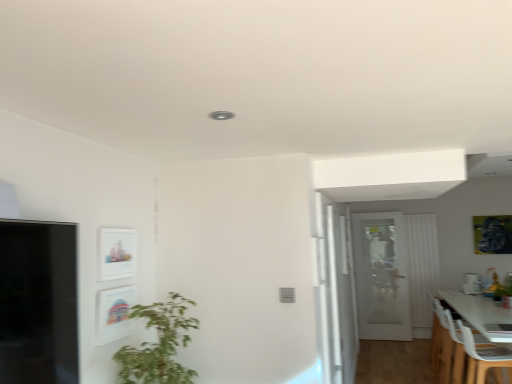
The image size is (512, 384). Identify the location of transparent glass door at center. pyautogui.click(x=339, y=292).

The width and height of the screenshot is (512, 384). Find the location of `green leafy plant at lower left`. green leafy plant at lower left is located at coordinates (159, 344).

Locate an element on the screen. This screenshot has width=512, height=384. white plastic chair at lower right, the second chair in the front-to-back sequence is located at coordinates 446,347.

Find the location of `matte white picture frame at lower left, which ranks as the 2th picture frame in right-to-left order`. matte white picture frame at lower left, which ranks as the 2th picture frame in right-to-left order is located at coordinates (114, 313).

Find the location of a particular element. white plastic chair at lower right, marked as the second chair in a back-to-front arrangement is located at coordinates (447, 344).

Where is `transparent glass door at center`? The image size is (512, 384). transparent glass door at center is located at coordinates (339, 292).

Who is smaller, white fabric curtain at right or matte white picture frame at upper left, arranged as the second picture frame when viewed from the back?

With smaller size is matte white picture frame at upper left, arranged as the second picture frame when viewed from the back.

From a real-world perspective, which is physically below, white fabric curtain at right or matte white picture frame at upper left, arranged as the second picture frame when viewed from the back?

white fabric curtain at right.

Are white plastic swivel chair at lower right and green leafy plant at lower left far apart?

That's right, there is a large distance between white plastic swivel chair at lower right and green leafy plant at lower left.

From the image's perspective, which object appears higher, white plastic swivel chair at lower right or green leafy plant at lower left?

green leafy plant at lower left is shown above in the image.

Which of these two, white plastic swivel chair at lower right or green leafy plant at lower left, stands shorter?

white plastic swivel chair at lower right is shorter.

Considering the points (492, 365) and (172, 364), which point is in front, point (492, 365) or point (172, 364)?

Point (172, 364)

Does point (330, 220) appear closer or farther from the camera than point (429, 249)?

Clearly, point (330, 220) is closer to the camera than point (429, 249).

How different are the orientations of transparent glass door at center and white fabric curtain at right in degrees?

They differ by 89.1 degrees in their facing directions.

Can you see transparent glass door at center touching white fabric curtain at right?

No, transparent glass door at center is not beside white fabric curtain at right.

Considering the positions of objects transparent glass door at center and white fabric curtain at right in the image provided, who is in front, transparent glass door at center or white fabric curtain at right?

Positioned in front is transparent glass door at center.

Based on their sizes in the image, would you say white plastic chair at lower right, which is the 1th chair in front-to-back order, is bigger or smaller than green leafy plant at lower right?

In the image, white plastic chair at lower right, which is the 1th chair in front-to-back order, appears to be larger than green leafy plant at lower right.

Looking at their sizes, would you say white plastic chair at lower right, marked as the second chair in a back-to-front arrangement, is wider or thinner than green leafy plant at lower right?

white plastic chair at lower right, marked as the second chair in a back-to-front arrangement, is wider than green leafy plant at lower right.

Which is closer to the camera, (434, 305) or (511, 294)?

Point (434, 305)

Is matte white picture frame at upper left, marked as the third picture frame in a right-to-left arrangement, in contact with green leafy plant at lower right?

matte white picture frame at upper left, marked as the third picture frame in a right-to-left arrangement, and green leafy plant at lower right are clearly separated.

How much distance is there between matte white picture frame at upper left, arranged as the second picture frame when viewed from the back, and green leafy plant at lower right?

matte white picture frame at upper left, arranged as the second picture frame when viewed from the back, is 13.79 feet from green leafy plant at lower right.

Which object is positioned more to the left, matte white picture frame at upper left, which is the second picture frame in front-to-back order, or green leafy plant at lower right?

Positioned to the left is matte white picture frame at upper left, which is the second picture frame in front-to-back order.

How many degrees apart are the facing directions of matte white picture frame at upper left, which is the second picture frame in front-to-back order, and green leafy plant at lower right?

matte white picture frame at upper left, which is the second picture frame in front-to-back order, and green leafy plant at lower right are facing 91.2 degrees away from each other.

Based on the photo, how many degrees apart are the facing directions of matte white picture frame at upper left, which is the second picture frame in front-to-back order, and white plastic swivel chair at lower right?

The angular difference between matte white picture frame at upper left, which is the second picture frame in front-to-back order, and white plastic swivel chair at lower right is 0.535 degrees.

Consider the image. Could you tell me if matte white picture frame at upper left, positioned as the 1th picture frame in left-to-right order, is facing white plastic swivel chair at lower right?

No, matte white picture frame at upper left, positioned as the 1th picture frame in left-to-right order, is not facing towards white plastic swivel chair at lower right.

At what (x,y) coordinates should I click in order to perform the action: click on swivel chair behind the matte white picture frame at upper left, positioned as the 1th picture frame in left-to-right order. Please return your answer as a coordinate pair (x, y). The height and width of the screenshot is (384, 512). Looking at the image, I should click on (484, 358).

In the scene shown: Is matte white picture frame at upper left, marked as the third picture frame in a right-to-left arrangement, wider than white plastic swivel chair at lower right?

No, matte white picture frame at upper left, marked as the third picture frame in a right-to-left arrangement, is not wider than white plastic swivel chair at lower right.

Does green leafy plant at lower left come in front of white plastic swivel chair at lower right?

Yes, it is.

Considering the sizes of green leafy plant at lower left and white plastic swivel chair at lower right in the image, is green leafy plant at lower left taller or shorter than white plastic swivel chair at lower right?

In the image, green leafy plant at lower left appears to be taller than white plastic swivel chair at lower right.

From a real-world perspective, relative to white plastic swivel chair at lower right, is green leafy plant at lower left vertically above or below?

green leafy plant at lower left is situated higher than white plastic swivel chair at lower right in the real world.

Are green leafy plant at lower left and white plastic swivel chair at lower right making contact?

No, green leafy plant at lower left is not beside white plastic swivel chair at lower right.

Where is `curtain lying below the matte white picture frame at upper left, arranged as the second picture frame when viewed from the back (from the image's perspective)`? Image resolution: width=512 pixels, height=384 pixels. curtain lying below the matte white picture frame at upper left, arranged as the second picture frame when viewed from the back (from the image's perspective) is located at coordinates (422, 266).

Image resolution: width=512 pixels, height=384 pixels. Identify the location of houseplant located in front of the white plastic swivel chair at lower right. (159, 344).

In the scene shown: When comparing their distances from white plastic swivel chair at lower right, does white plastic chair at lower right, which is the 1th chair in front-to-back order, or green leafy plant at lower right seem closer?

white plastic chair at lower right, which is the 1th chair in front-to-back order.

Considering their positions, is transparent glass door at center positioned further to green leafy plant at lower left than metallic gold picture frame at upper right, which appears as the third picture frame when viewed from the left?

metallic gold picture frame at upper right, which appears as the third picture frame when viewed from the left, is further to green leafy plant at lower left.

Estimate the real-world distances between objects in this image. Which object is further from green leafy plant at lower right, white plastic chair at lower right, marked as the second chair in a back-to-front arrangement, or matte white picture frame at lower left, which ranks as the 2th picture frame in right-to-left order?

Based on the image, matte white picture frame at lower left, which ranks as the 2th picture frame in right-to-left order, appears to be further to green leafy plant at lower right.

In the scene shown: Which object lies further to the anchor point transparent glass door at center, white plastic swivel chair at lower right or white glass door at center?

white glass door at center is positioned further to the anchor transparent glass door at center.

Based on their spatial positions, is green leafy plant at lower left or matte white picture frame at upper left, which is the second picture frame in front-to-back order, closer to green leafy plant at lower right?

green leafy plant at lower left lies closer to green leafy plant at lower right than the other object.

Considering their positions, is green leafy plant at lower right positioned further to white glass door at center than white plastic swivel chair at lower right?

white plastic swivel chair at lower right lies further to white glass door at center than the other object.

When comparing their distances from white plastic chair at lower right, acting as the first chair starting from the back, does white plastic swivel chair at lower right or metallic gold picture frame at upper right, marked as the first picture frame in a back-to-front arrangement, seem further?

Among the two, metallic gold picture frame at upper right, marked as the first picture frame in a back-to-front arrangement, is located further to white plastic chair at lower right, acting as the first chair starting from the back.

Which object lies nearer to the anchor point white plastic chair at lower right, the second chair in the front-to-back sequence, matte white picture frame at upper left, marked as the third picture frame in a right-to-left arrangement, or white glass door at center?

white glass door at center is closer to white plastic chair at lower right, the second chair in the front-to-back sequence.

The image size is (512, 384). Find the location of `swivel chair situated between matte white picture frame at upper left, marked as the third picture frame in a right-to-left arrangement, and green leafy plant at lower right from left to right`. swivel chair situated between matte white picture frame at upper left, marked as the third picture frame in a right-to-left arrangement, and green leafy plant at lower right from left to right is located at coordinates (484, 358).

Find the location of a particular element. picture frame between white plastic chair at lower right, the second chair in the front-to-back sequence, and white fabric curtain at right from front to back is located at coordinates (493, 234).

This screenshot has height=384, width=512. Find the location of `plant between white plastic swivel chair at lower right and metallic gold picture frame at upper right, which appears as the third picture frame when viewed from the left, along the z-axis`. plant between white plastic swivel chair at lower right and metallic gold picture frame at upper right, which appears as the third picture frame when viewed from the left, along the z-axis is located at coordinates (504, 288).

What are the coordinates of `plant between green leafy plant at lower left and white fabric curtain at right along the z-axis` in the screenshot? It's located at (504, 288).